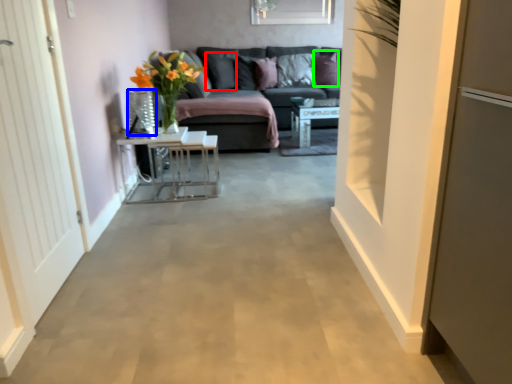
Question: Which is farther away from pillow (highlighted by a red box)? glass vase (highlighted by a blue box) or pillow (highlighted by a green box)?

Choices:
 (A) glass vase
 (B) pillow

Answer: (A)